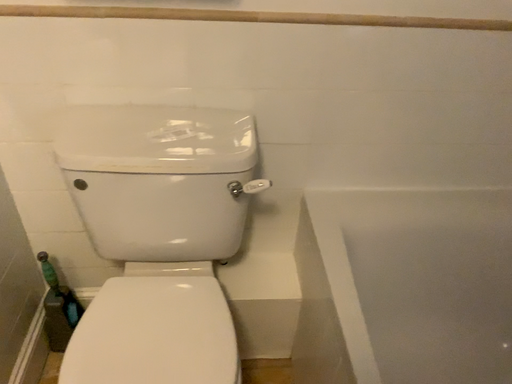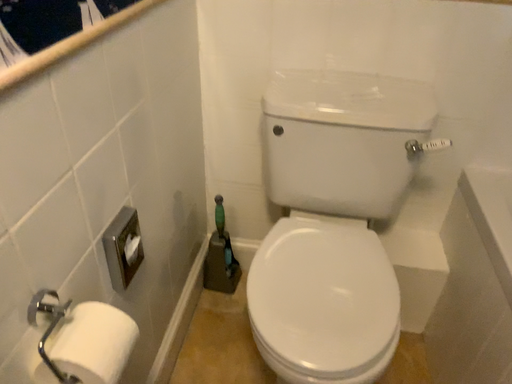
Question: Which way did the camera rotate in the video?

Choices:
 (A) rotated right
 (B) rotated left

Answer: (B)